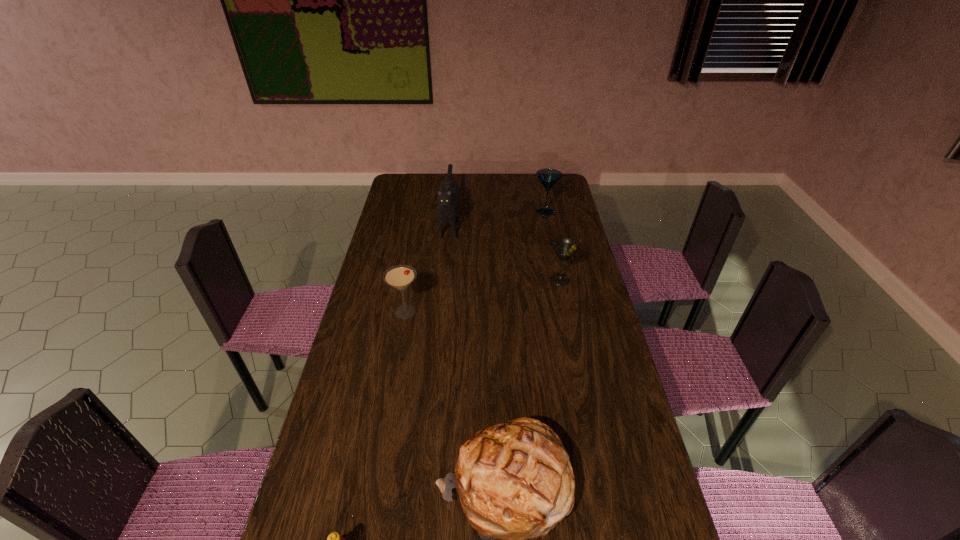
Where is `object that can be found as the closest to the bread`? The image size is (960, 540). object that can be found as the closest to the bread is located at coordinates (334, 539).

Identify the location of the closest martini relative to the third farthest object. (548, 177).

This screenshot has height=540, width=960. In order to click on martini that is the closest to the Lego in this screenshot , I will do `click(399, 277)`.

Where is `vacant position in the image that satisfies the following two spatial constraints: 1. on the front side of the farthest martini; 2. on the right side of the second farthest martini`? This screenshot has width=960, height=540. vacant position in the image that satisfies the following two spatial constraints: 1. on the front side of the farthest martini; 2. on the right side of the second farthest martini is located at coordinates pyautogui.click(x=559, y=280).

The image size is (960, 540). In order to click on free space that satisfies the following two spatial constraints: 1. on the back side of the fourth farthest object; 2. on the right side of the second farthest martini in this screenshot , I will do `click(411, 280)`.